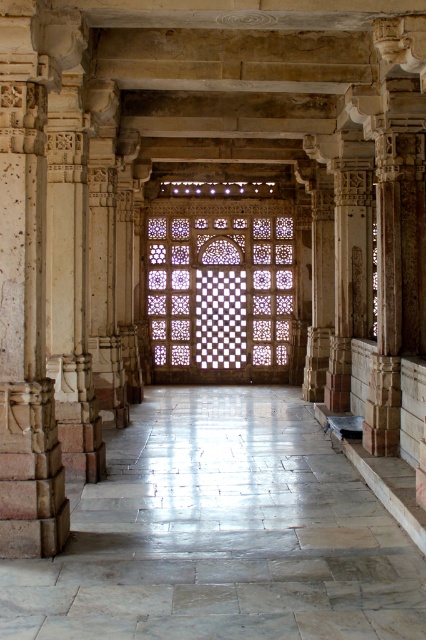
Is white marble corridor at center shorter than translucent stone lattice at center?

Correct, white marble corridor at center is not as tall as translucent stone lattice at center.

Can you confirm if white marble corridor at center is smaller than translucent stone lattice at center?

No.

What are the coordinates of `white marble corridor at center` in the screenshot? It's located at (221, 532).